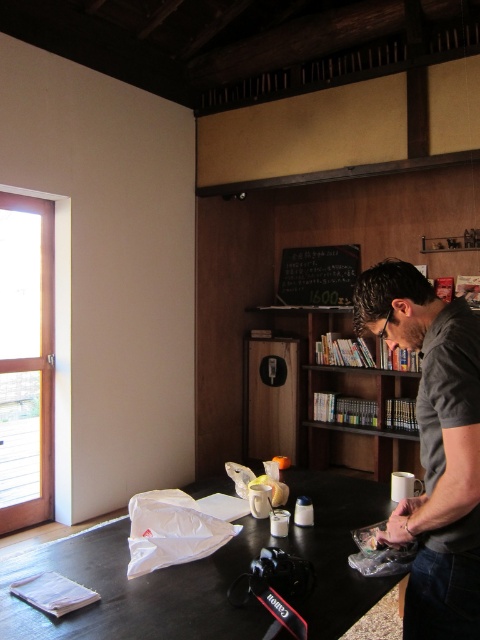
Question: Is dark gray shirt at center to the left of wooden bookshelf at center from the viewer's perspective?

Choices:
 (A) yes
 (B) no

Answer: (A)

Question: Can you confirm if dark gray shirt at center is positioned below wooden bookshelf at center?

Choices:
 (A) no
 (B) yes

Answer: (A)

Question: Which point appears closest to the camera in this image?

Choices:
 (A) (418, 410)
 (B) (325, 387)

Answer: (A)

Question: Where is wooden bookshelf at center located in relation to black chalkboard at upper center in the image?

Choices:
 (A) right
 (B) left

Answer: (A)

Question: Estimate the real-world distances between objects in this image. Which object is farther from the dark gray shirt at center?

Choices:
 (A) white paper at center
 (B) black chalkboard at upper center

Answer: (B)

Question: Based on their relative distances, which object is farther from the white paper at center?

Choices:
 (A) black chalkboard at upper center
 (B) dark gray shirt at center
 (C) wooden bookshelf at center

Answer: (A)